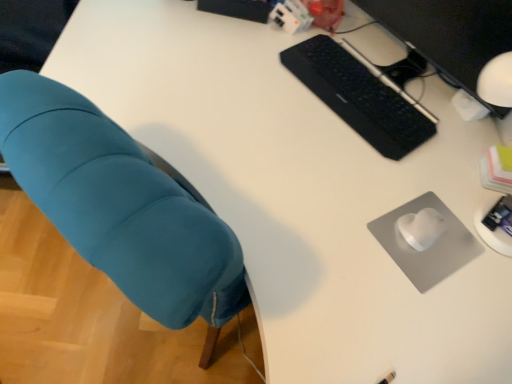
This screenshot has height=384, width=512. I want to click on free point behind gray matte mousepad at lower right, so click(x=429, y=181).